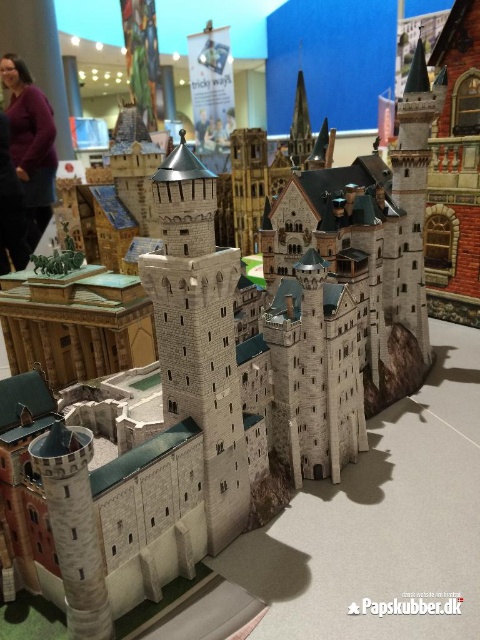
Question: Is stone tower at center positioned before purple matte sweater at upper left?

Choices:
 (A) yes
 (B) no

Answer: (A)

Question: Does stone tower at center appear over purple matte sweater at upper left?

Choices:
 (A) no
 (B) yes

Answer: (A)

Question: Can you confirm if stone tower at center is positioned to the left of purple matte sweater at upper left?

Choices:
 (A) yes
 (B) no

Answer: (B)

Question: Which point appears closest to the camera in this image?

Choices:
 (A) (229, 404)
 (B) (28, 177)

Answer: (A)